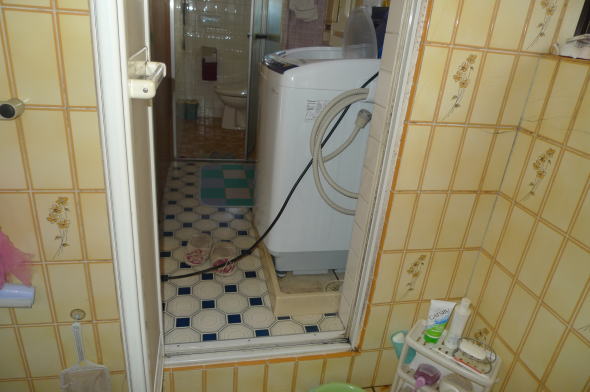
Where is `floral tile`? The image size is (590, 392). floral tile is located at coordinates (57, 225), (408, 279), (536, 170), (451, 81), (542, 11), (481, 337).